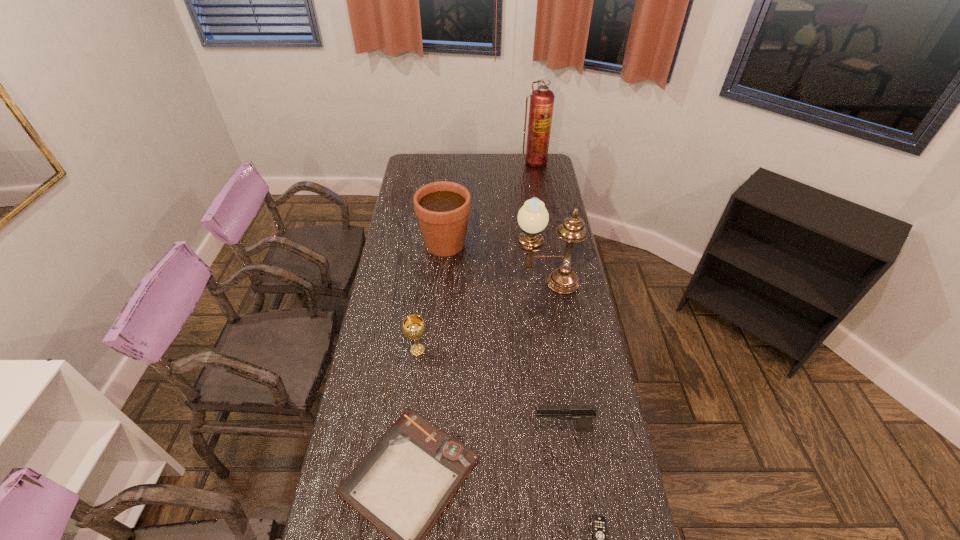
Where is `object that is at the far right corner`? This screenshot has width=960, height=540. object that is at the far right corner is located at coordinates (542, 99).

In the image, there is a desktop. At what (x,y) coordinates should I click in order to perform the action: click on free region at the far edge. Please return your answer as a coordinate pair (x, y). This screenshot has width=960, height=540. Looking at the image, I should click on (464, 166).

Locate an element on the screen. vacant space at the left edge of the desktop is located at coordinates [371, 343].

Identify the location of blank space at the right edge. The image size is (960, 540). (564, 327).

Locate an element on the screen. The height and width of the screenshot is (540, 960). free region at the far left corner of the desktop is located at coordinates (406, 172).

This screenshot has height=540, width=960. In order to click on vacant space in between the chalice and the flowerpot in this screenshot , I will do `click(431, 297)`.

In order to click on vacant area between the oil lamp and the fourth nearest object in this screenshot , I will do `click(482, 316)`.

I want to click on vacant area between the fourth tallest object and the farthest object, so click(x=476, y=256).

This screenshot has height=540, width=960. Identify the location of vacant space in between the pistol and the fourth farthest object. (491, 389).

The height and width of the screenshot is (540, 960). In order to click on object that is the closest to the oil lamp in this screenshot , I will do `click(442, 208)`.